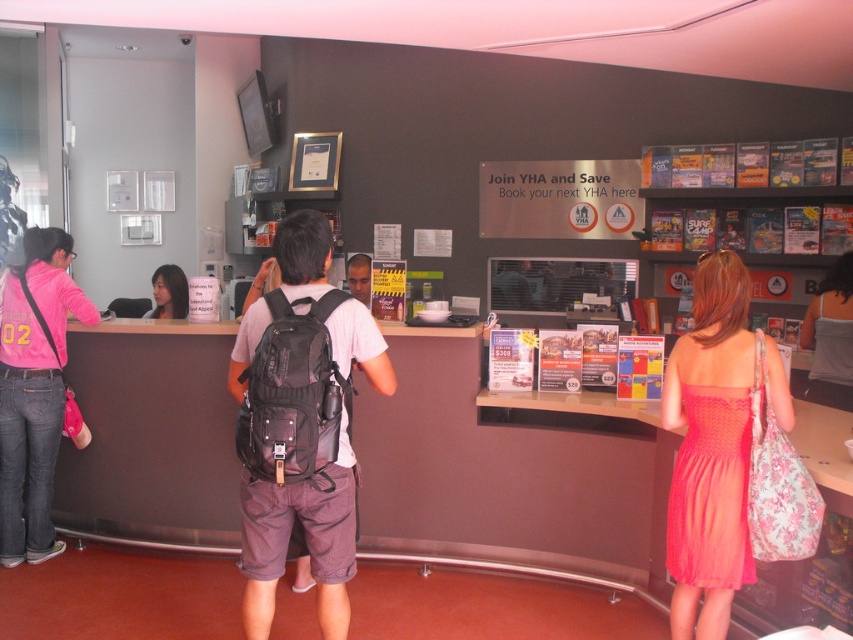
Question: Is matte black backpack at center further to camera compared to matte black hair at center?

Choices:
 (A) yes
 (B) no

Answer: (B)

Question: Does matte coral dress at center have a lesser width compared to matte black hair at center?

Choices:
 (A) yes
 (B) no

Answer: (B)

Question: Which of the following is the closest to the observer?

Choices:
 (A) (668, 500)
 (B) (173, 294)
 (C) (64, 241)

Answer: (A)

Question: Does matte coral dress at center appear on the left side of pink satin dress at center?

Choices:
 (A) no
 (B) yes

Answer: (B)

Question: Among these objects, which one is farthest from the camera?

Choices:
 (A) matte coral dress at center
 (B) matte black backpack at center
 (C) pink fabric backpack at left
 (D) pink satin dress at center

Answer: (D)

Question: Among these points, which one is nearest to the camera?

Choices:
 (A) pyautogui.click(x=277, y=545)
 (B) pyautogui.click(x=0, y=342)
 (C) pyautogui.click(x=822, y=337)
 (D) pyautogui.click(x=167, y=284)

Answer: (A)